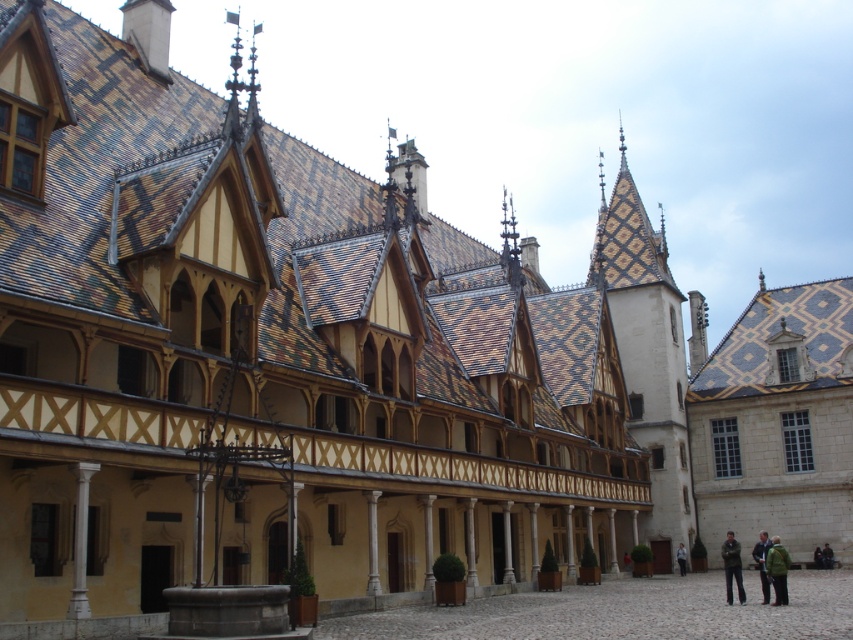
Which is below, dark blue jacket at lower right or green fabric jacket at lower right?

green fabric jacket at lower right is below.

Consider the image. Does dark blue jacket at lower right have a lesser width compared to green fabric jacket at lower right?

No.

Who is more forward, [761,554] or [827,557]?

Point [761,554] is more forward.

At what (x,y) coordinates should I click in order to perform the action: click on dark blue jacket at lower right. Please return your answer as a coordinate pair (x, y). The image size is (853, 640). Looking at the image, I should click on (762, 563).

Can you confirm if dark blue jacket at lower right is positioned above light brown leather jacket at lower right?

Yes, dark blue jacket at lower right is above light brown leather jacket at lower right.

Who is taller, dark blue jacket at lower right or light brown leather jacket at lower right?

With more height is dark blue jacket at lower right.

Locate an element on the screen. dark blue jacket at lower right is located at coordinates (762, 563).

Can you confirm if dark gray jacket at lower right is positioned below green fabric jacket at lower right?

Actually, dark gray jacket at lower right is above green fabric jacket at lower right.

Does point (724, 547) come behind point (827, 561)?

No, it is not.

Is point (726, 576) behind point (828, 548)?

No, it is in front of (828, 548).

Image resolution: width=853 pixels, height=640 pixels. In order to click on dark gray jacket at lower right in this screenshot , I will do `click(732, 566)`.